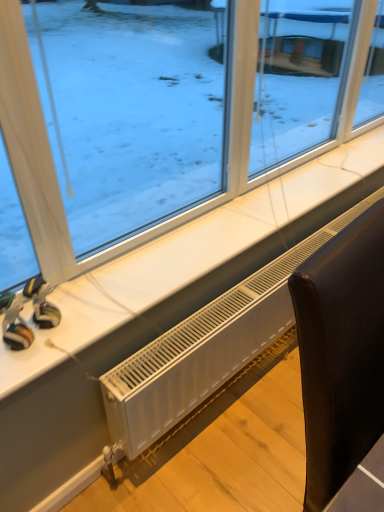
Question: Is white plastic radiator at lower center outside of black leather chair at lower right?

Choices:
 (A) no
 (B) yes

Answer: (B)

Question: From the image's perspective, is white plastic radiator at lower center located above black leather chair at lower right?

Choices:
 (A) no
 (B) yes

Answer: (B)

Question: From a real-world perspective, does white plastic radiator at lower center sit lower than black leather chair at lower right?

Choices:
 (A) no
 (B) yes

Answer: (B)

Question: Is white plastic radiator at lower center not near black leather chair at lower right?

Choices:
 (A) no
 (B) yes

Answer: (A)

Question: Is white plastic radiator at lower center closer to camera compared to black leather chair at lower right?

Choices:
 (A) yes
 (B) no

Answer: (B)

Question: Can you confirm if white plastic radiator at lower center is bigger than black leather chair at lower right?

Choices:
 (A) no
 (B) yes

Answer: (A)

Question: Considering the relative sizes of transparent glass window at upper center and rubberized plastic toy at lower left, which is counted as the 1th toy, starting from the left, in the image provided, is transparent glass window at upper center bigger than rubberized plastic toy at lower left, which is counted as the 1th toy, starting from the left,?

Choices:
 (A) no
 (B) yes

Answer: (B)

Question: From the image's perspective, is transparent glass window at upper center on top of rubberized plastic toy at lower left, the second toy in the right-to-left sequence?

Choices:
 (A) yes
 (B) no

Answer: (A)

Question: Can you confirm if transparent glass window at upper center is thinner than rubberized plastic toy at lower left, the second toy in the right-to-left sequence?

Choices:
 (A) yes
 (B) no

Answer: (B)

Question: Can you confirm if transparent glass window at upper center is smaller than rubberized plastic toy at lower left, the second toy in the right-to-left sequence?

Choices:
 (A) yes
 (B) no

Answer: (B)

Question: Is transparent glass window at upper center not near rubberized plastic toy at lower left, the second toy in the right-to-left sequence?

Choices:
 (A) yes
 (B) no

Answer: (B)

Question: Is transparent glass window at upper center taller than rubberized plastic toy at lower left, the second toy in the right-to-left sequence?

Choices:
 (A) yes
 (B) no

Answer: (A)

Question: Can you confirm if white plastic radiator at lower center is bigger than rubberized plastic toy at lower left, the second toy in the right-to-left sequence?

Choices:
 (A) yes
 (B) no

Answer: (A)